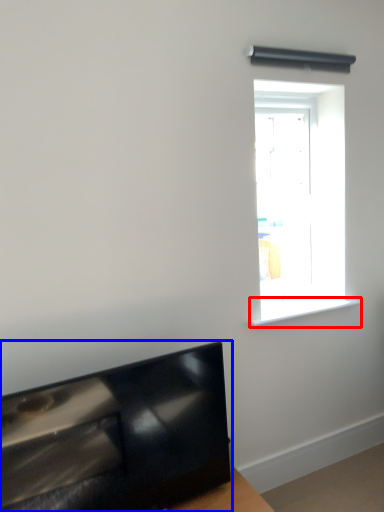
Question: Among these objects, which one is nearest to the camera, window sill (highlighted by a red box) or furniture (highlighted by a blue box)?

Choices:
 (A) window sill
 (B) furniture

Answer: (B)